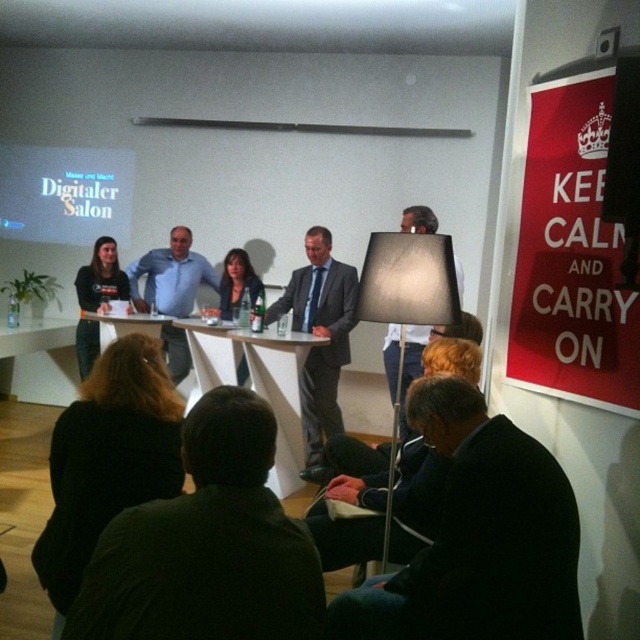
Consider the image. Who is taller, white fabric lampshade at center or white glossy table at lower center?

white fabric lampshade at center

Which is above, white fabric lampshade at center or white glossy table at lower center?

white glossy table at lower center

Between point (422, 266) and point (64, 364), which one is positioned behind?

Point (64, 364)

This screenshot has width=640, height=640. Identify the location of white fabric lampshade at center. (404, 280).

Is dark green shirt at lower center closer to camera compared to dark suit at lower right?

Yes.

Between point (179, 509) and point (364, 611), which one is positioned behind?

Positioned behind is point (364, 611).

Locate an element on the screen. Image resolution: width=640 pixels, height=640 pixels. dark green shirt at lower center is located at coordinates (208, 545).

Does point (483, 552) lie behind point (454, 262)?

No, (483, 552) is closer to viewer.

Who is more forward, (493, 448) or (400, 273)?

Point (493, 448)

Find the location of `dark suit at lower right`. dark suit at lower right is located at coordinates (477, 538).